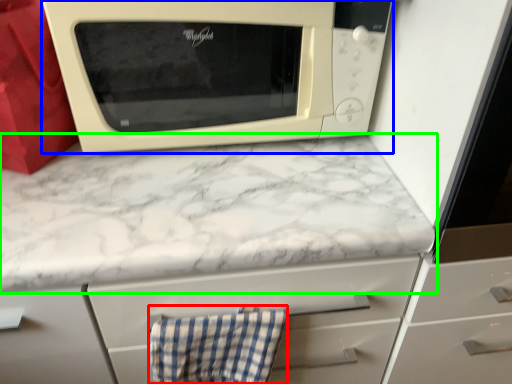
Question: Considering the real-world distances, which object is farthest from hand towel (highlighted by a red box)? microwave oven (highlighted by a blue box) or countertop (highlighted by a green box)?

Choices:
 (A) microwave oven
 (B) countertop

Answer: (A)